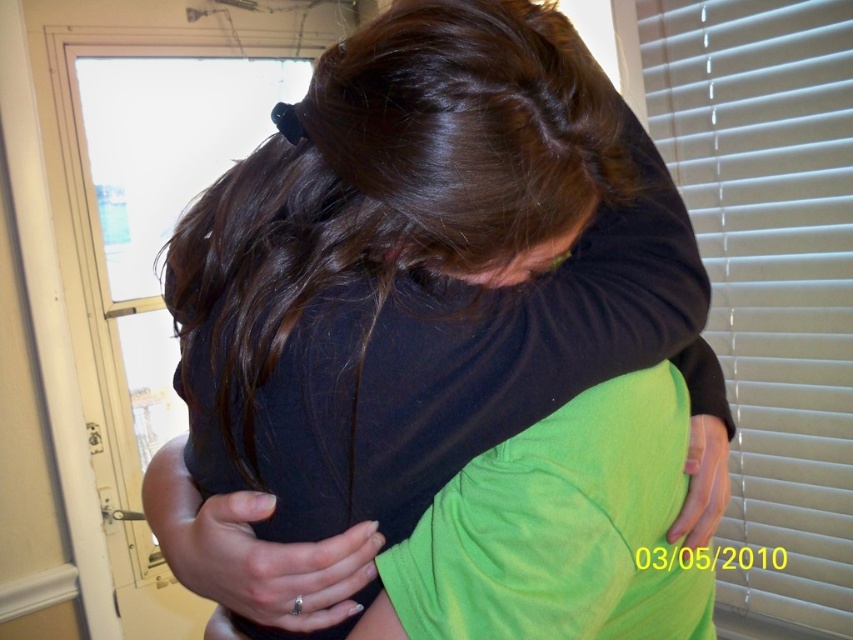
Question: Observing the image, what is the correct spatial positioning of matte black shirt at center in reference to white blinds at right?

Choices:
 (A) above
 (B) below

Answer: (B)

Question: Is matte black shirt at center to the right of white blinds at right from the viewer's perspective?

Choices:
 (A) no
 (B) yes

Answer: (A)

Question: Which of the following is the closest to the observer?

Choices:
 (A) (782, 339)
 (B) (674, 260)

Answer: (B)

Question: In this image, where is matte black shirt at center located relative to white blinds at right?

Choices:
 (A) above
 (B) below

Answer: (B)